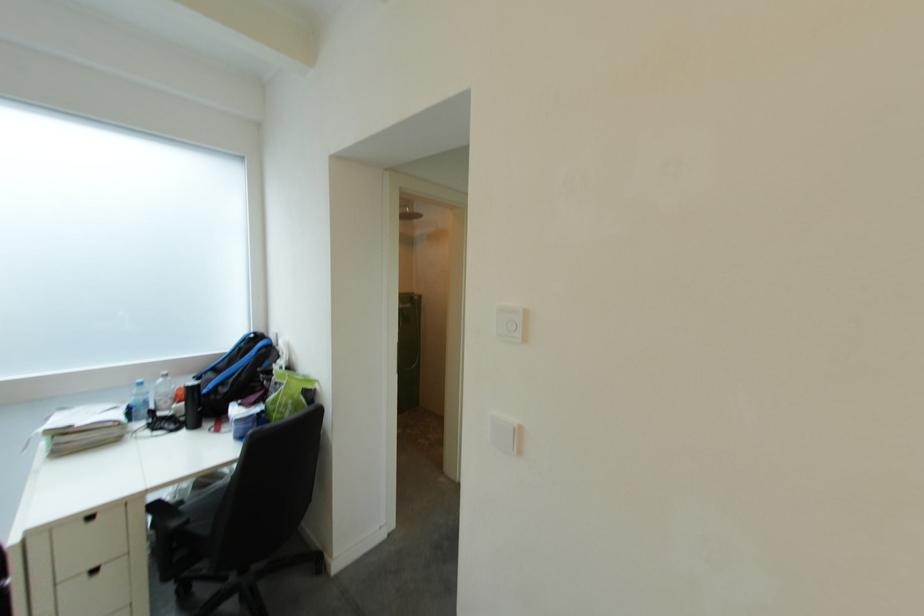
The width and height of the screenshot is (924, 616). Identify the location of chair armrest. (169, 515).